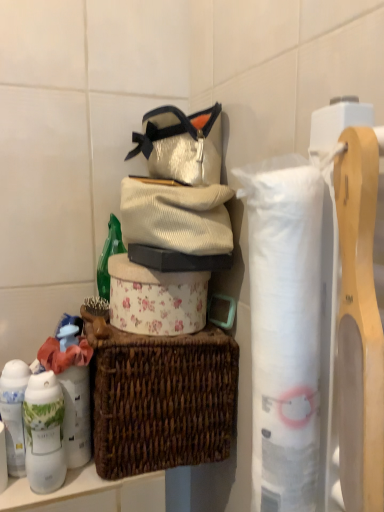
Question: Is white glossy lotion at lower left, the 2th toiletry viewed from the right, in front of or behind white matte toilet paper at center, arranged as the 1th toilet paper when viewed from the left, in the image?

Choices:
 (A) front
 (B) behind

Answer: (A)

Question: Considering the positions of white glossy lotion at lower left, the 2th toiletry viewed from the right, and white matte toilet paper at center, which is counted as the 2th toilet paper, starting from the front, in the image, is white glossy lotion at lower left, the 2th toiletry viewed from the right, taller or shorter than white matte toilet paper at center, which is counted as the 2th toilet paper, starting from the front,?

Choices:
 (A) short
 (B) tall

Answer: (B)

Question: Which object is the farthest from the white matte toilet paper at center, which ranks as the 2th toilet paper in right-to-left order?

Choices:
 (A) white glossy lotion at lower left, the 2th toiletry viewed from the right
 (B) corduroy sweater at center
 (C) white matte canister at left, which appears as the 2th toiletry when viewed from the left
 (D) white paper towel at right, acting as the second toilet paper starting from the left
 (E) brown woven picnic basket at center

Answer: (D)

Question: Which of these objects is positioned farthest from the corduroy sweater at center?

Choices:
 (A) brown woven picnic basket at center
 (B) white glossy lotion at lower left, the 2th toiletry viewed from the right
 (C) white matte toilet paper at center, which is counted as the 2th toilet paper, starting from the front
 (D) white paper towel at right, which is the 2th toilet paper from back to front
 (E) white matte canister at left, the 1th toiletry in the right-to-left sequence

Answer: (B)